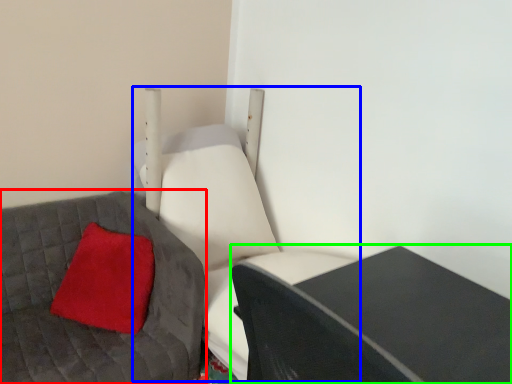
Question: Considering the real-world distances, which object is closest to furniture (highlighted by a red box)? swivel chair (highlighted by a blue box) or table (highlighted by a green box).

Choices:
 (A) swivel chair
 (B) table

Answer: (A)